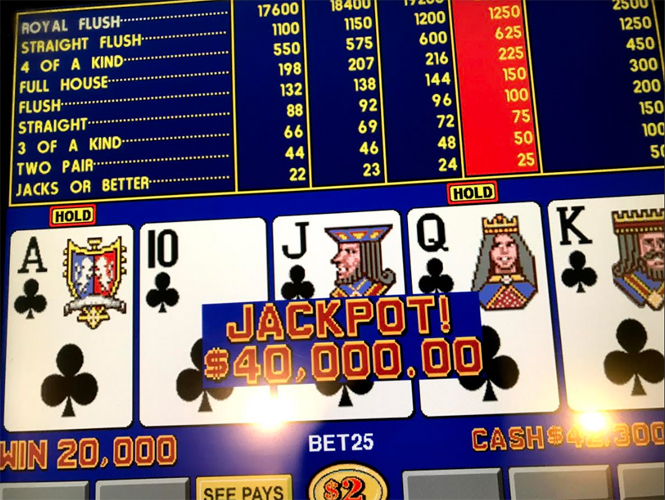
Where is `1 red column`? This screenshot has height=500, width=665. 1 red column is located at coordinates (481, 135).